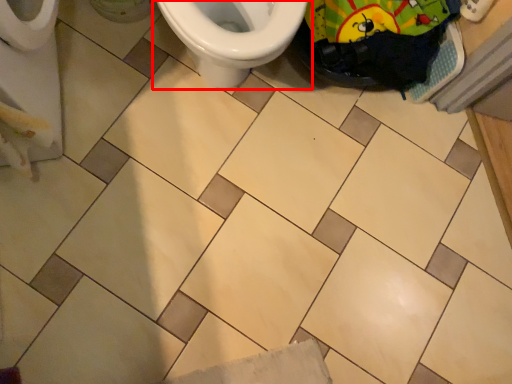
Question: From the image's perspective, what is the correct spatial relationship of toilet (annotated by the red box) in relation to material?

Choices:
 (A) below
 (B) above

Answer: (B)